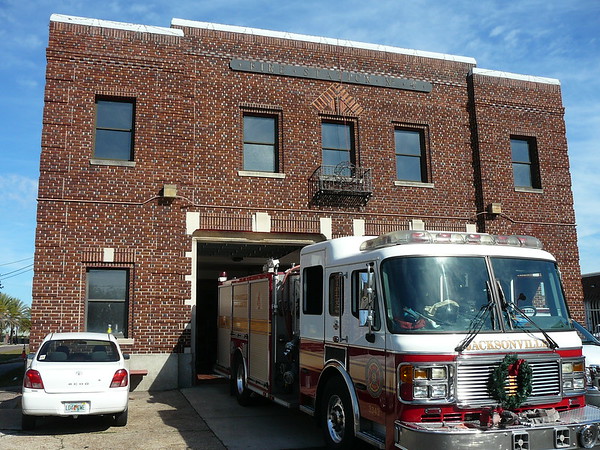
Locate an element on the screen. The image size is (600, 450). window is located at coordinates (270, 159).